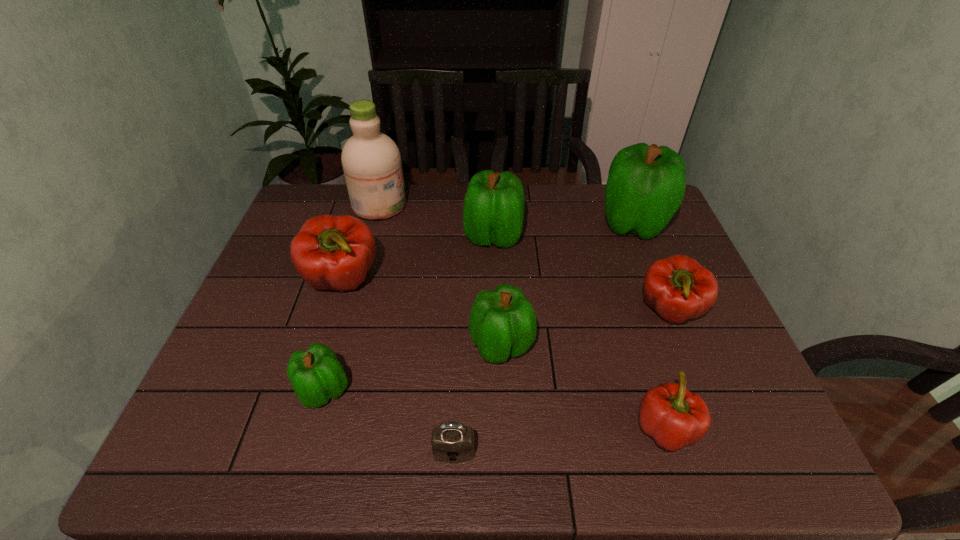
In order to click on vacant space that is in between the third biggest green bell pepper and the biggest pink bell pepper in this screenshot , I will do `click(422, 313)`.

The height and width of the screenshot is (540, 960). I want to click on vacant area that lies between the cleansing agent and the second biggest green bell pepper, so tap(437, 221).

Find the location of a particular element. blank region between the tallest object and the second biggest green bell pepper is located at coordinates (437, 221).

Locate an element on the screen. This screenshot has width=960, height=540. free space between the second biggest pink bell pepper and the tallest object is located at coordinates (524, 258).

Where is `vacant area that lies between the padlock and the leftmost green bell pepper`? The image size is (960, 540). vacant area that lies between the padlock and the leftmost green bell pepper is located at coordinates (389, 421).

You are a GUI agent. You are given a task and a screenshot of the screen. Output one action in this format:
    pyautogui.click(x=<x>, y=<y>)
    Task: Click on the vacant space that's between the padlock and the tallest bell pepper
    The width and height of the screenshot is (960, 540).
    Given the screenshot: What is the action you would take?
    pyautogui.click(x=543, y=338)

Where is `vacant space in between the rightmost green bell pepper and the padlock`? vacant space in between the rightmost green bell pepper and the padlock is located at coordinates (543, 338).

Select which object appears as the eighth closest to the biggest pink bell pepper. Please provide its 2D coordinates. Your answer should be formatted as a tuple, i.e. [(x, y)], where the tuple contains the x and y coordinates of a point satisfying the conditions above.

[(678, 288)]

Locate which object ranks fifth in proximity to the padlock. Please provide its 2D coordinates. Your answer should be formatted as a tuple, i.e. [(x, y)], where the tuple contains the x and y coordinates of a point satisfying the conditions above.

[(678, 288)]

Locate an element on the screen. This screenshot has height=540, width=960. the second closest bell pepper to the nearest pink bell pepper is located at coordinates (502, 323).